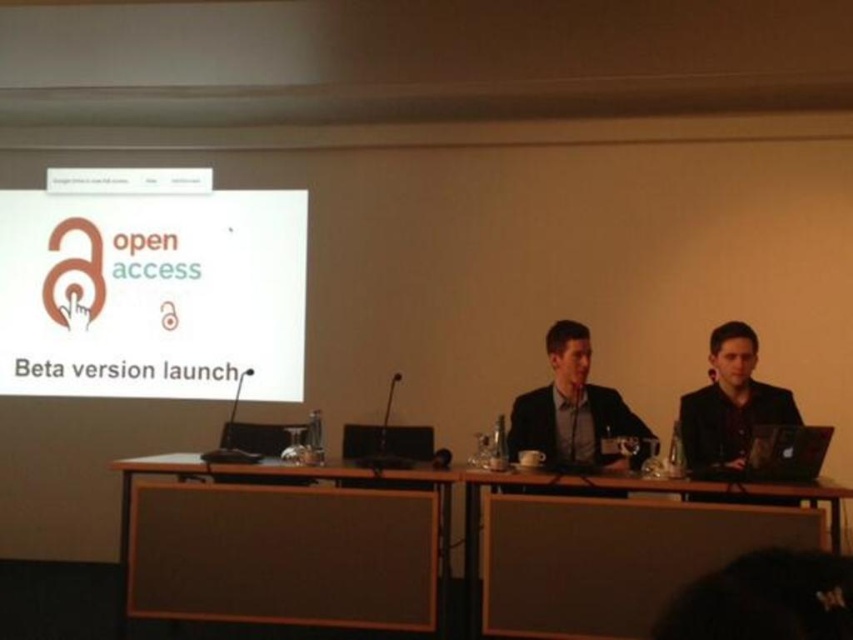
Question: Is white paper at upper center to the left of dark brown suit at right from the viewer's perspective?

Choices:
 (A) yes
 (B) no

Answer: (A)

Question: Which point is farther to the camera?

Choices:
 (A) (689, 531)
 (B) (514, 404)

Answer: (B)

Question: Which point appears farthest from the camera in this image?

Choices:
 (A) [x=277, y=397]
 (B) [x=426, y=520]
 (C) [x=605, y=403]
 (D) [x=614, y=612]

Answer: (A)

Question: Is black suit at center thinner than dark brown suit at right?

Choices:
 (A) yes
 (B) no

Answer: (A)

Question: Is black suit at center thinner than dark brown suit at right?

Choices:
 (A) no
 (B) yes

Answer: (B)

Question: Considering the real-world distances, which object is closest to the black suit at center?

Choices:
 (A) brown fabric table at center
 (B) dark brown suit at right
 (C) wooden table at center

Answer: (C)